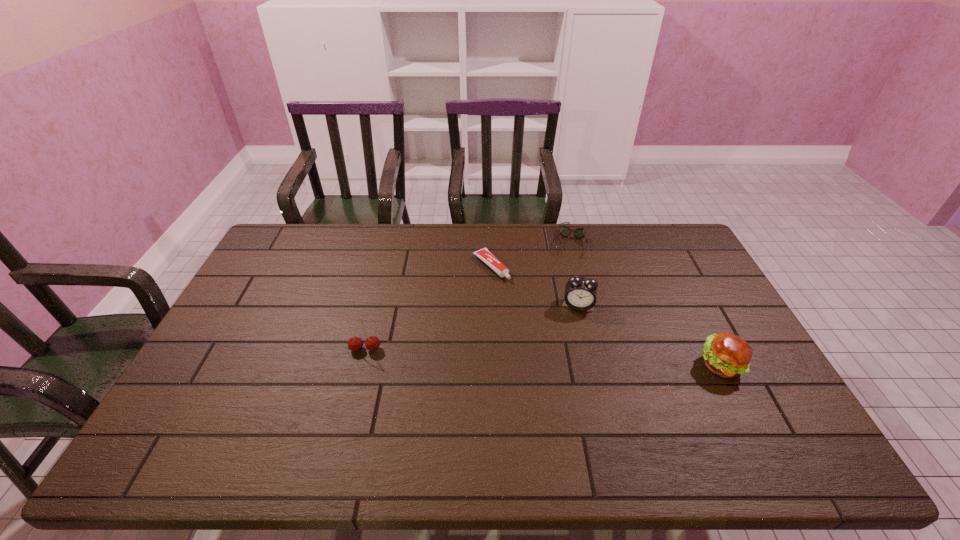
This screenshot has height=540, width=960. I want to click on free point between the cherry and the spectacles, so click(468, 296).

Where is `free space between the cherry and the third farthest object`? The width and height of the screenshot is (960, 540). free space between the cherry and the third farthest object is located at coordinates (471, 327).

Identify the location of empty space that is in between the leftmost object and the fourth object from right to left. (428, 308).

Identify the location of free space that is in between the second shortest object and the leftmost object. The width and height of the screenshot is (960, 540). (468, 296).

Identify the location of free space between the third shortest object and the third farthest object. (649, 335).

Where is `object identified as the third closest to the second shortest object`? object identified as the third closest to the second shortest object is located at coordinates (728, 355).

Choose which object is the fourth nearest neighbor to the shortest object. Please provide its 2D coordinates. Your answer should be formatted as a tuple, i.e. [(x, y)], where the tuple contains the x and y coordinates of a point satisfying the conditions above.

[(728, 355)]

This screenshot has width=960, height=540. In order to click on free location that satisfies the following two spatial constraints: 1. on the surface of the cherry; 2. on the right side of the third shortest object in this screenshot , I will do `click(361, 365)`.

I want to click on vacant area that satisfies the following two spatial constraints: 1. on the surface of the cherry; 2. on the right side of the third shortest object, so click(x=361, y=365).